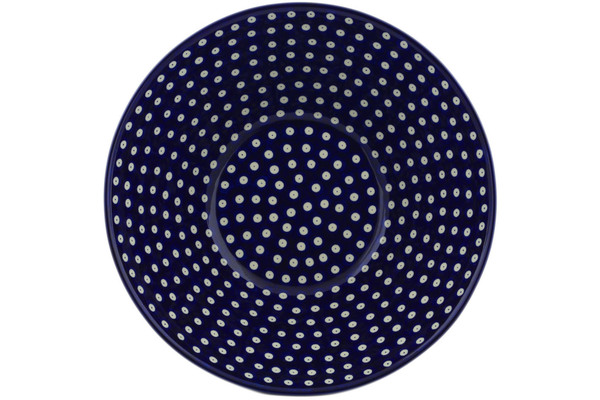
Locate an element on the screen. plate is located at coordinates (278, 205).